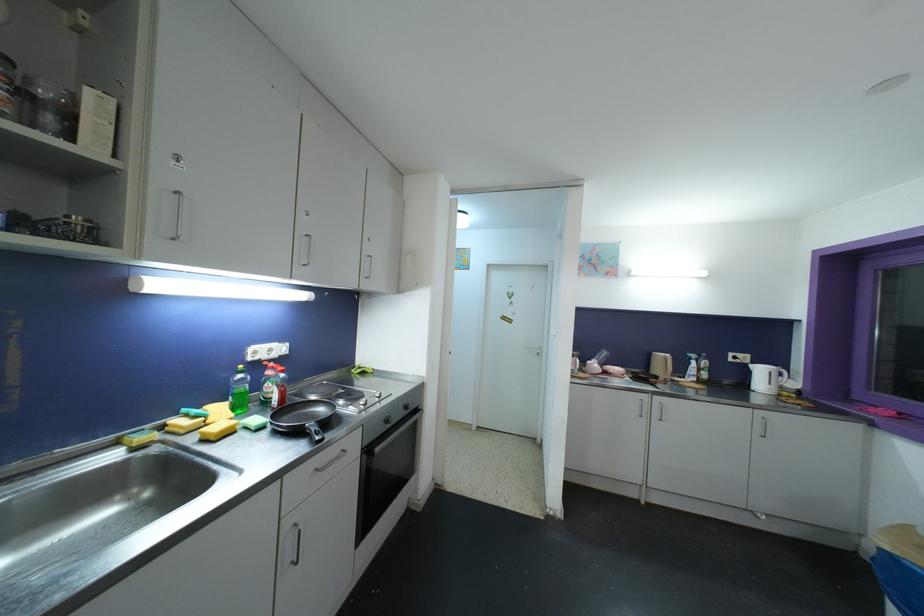
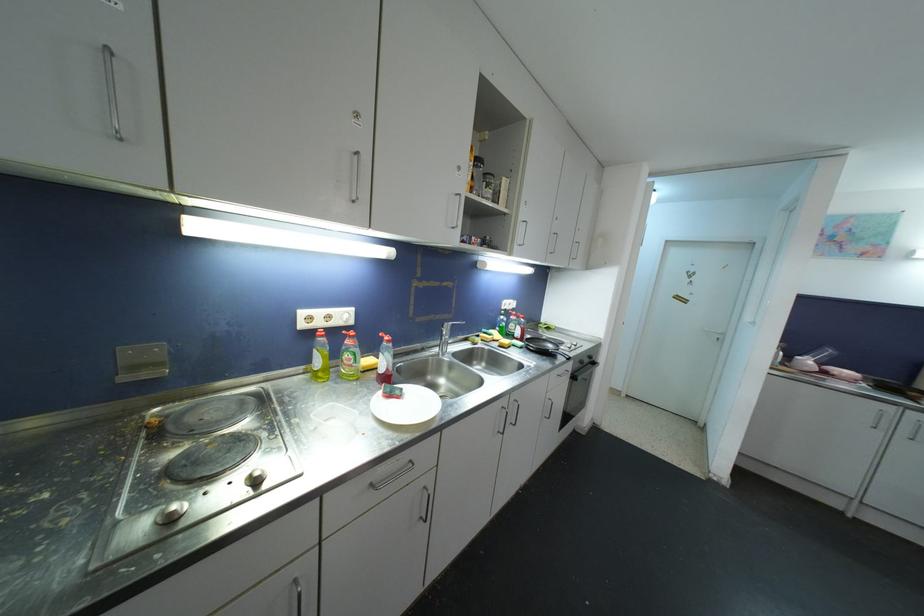
The images are taken continuously from a first-person perspective. In which direction are you moving?

The cameraman moved toward left, backward.